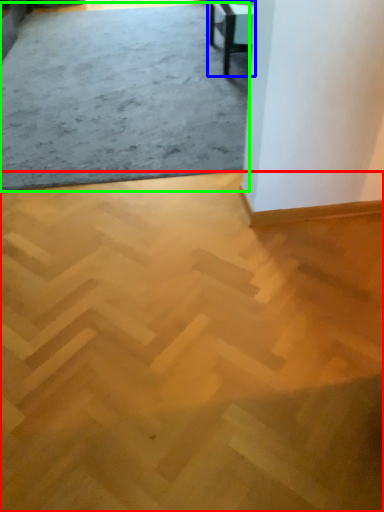
Question: Considering the real-world distances, which object is closest to concrete (highlighted by a red box)? table (highlighted by a blue box) or concrete (highlighted by a green box).

Choices:
 (A) table
 (B) concrete

Answer: (B)